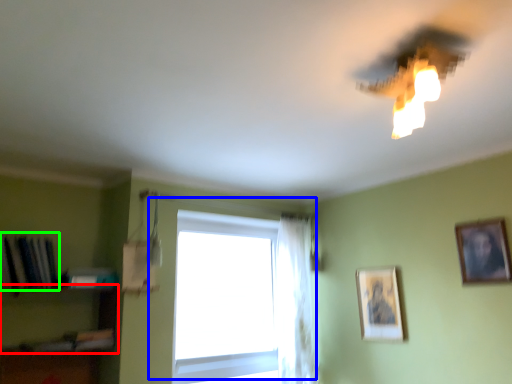
Question: Which object is the closest to the shelf (highlighted by a red box)? Choose among these: window (highlighted by a blue box) or book (highlighted by a green box).

Choices:
 (A) window
 (B) book

Answer: (B)